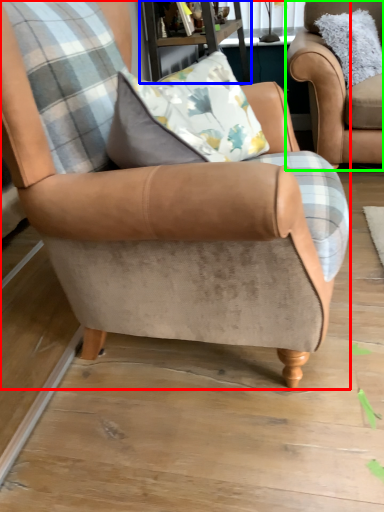
Question: Considering the real-world distances, which object is farthest from chair (highlighted by a red box)? table (highlighted by a blue box) or chair (highlighted by a green box)?

Choices:
 (A) table
 (B) chair

Answer: (B)